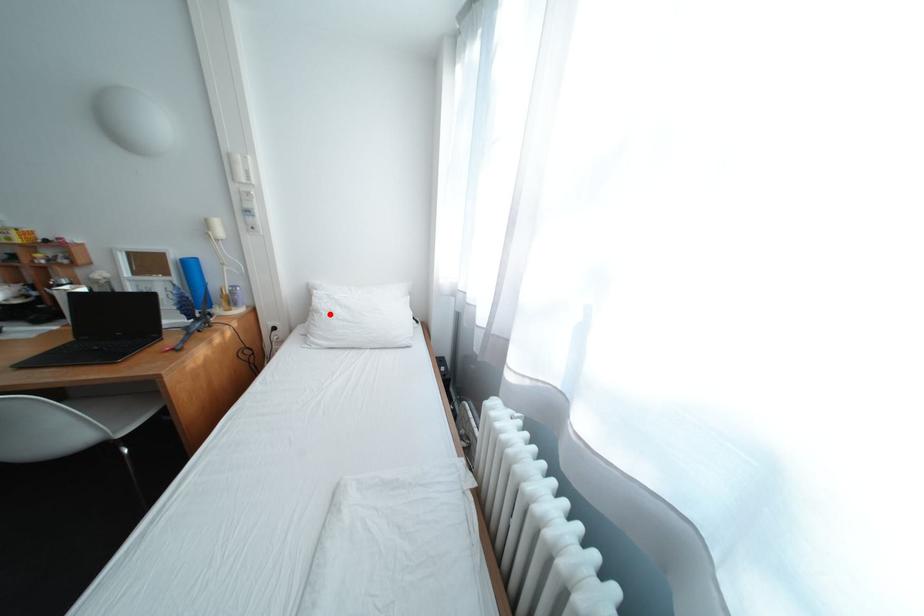
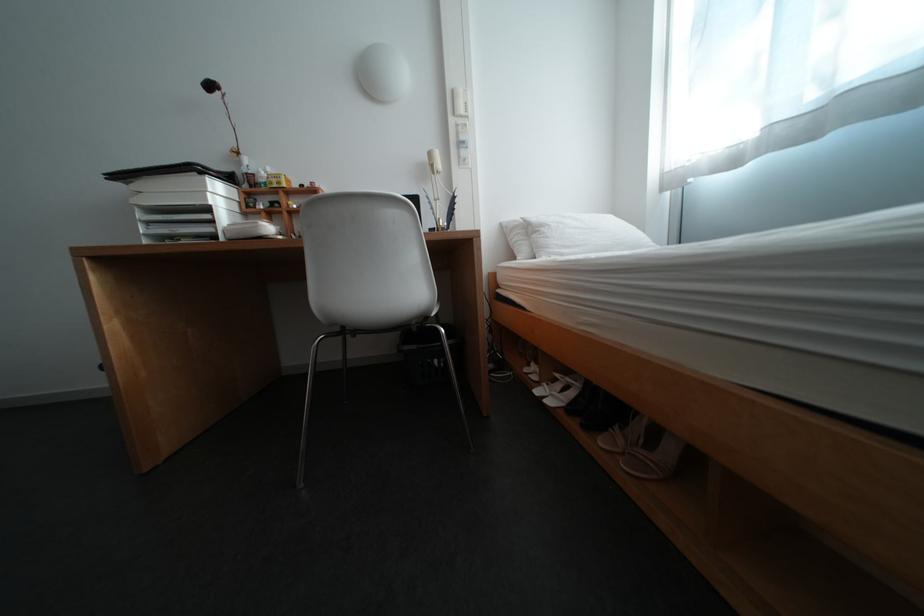
Question: A red point is marked in image1. In image2, is the corresponding 3D point closer to the camera or farther? Reply with the corresponding letter.

Choices:
 (A) The corresponding 3D point is closer.
 (B) The corresponding 3D point is farther.

Answer: (A)